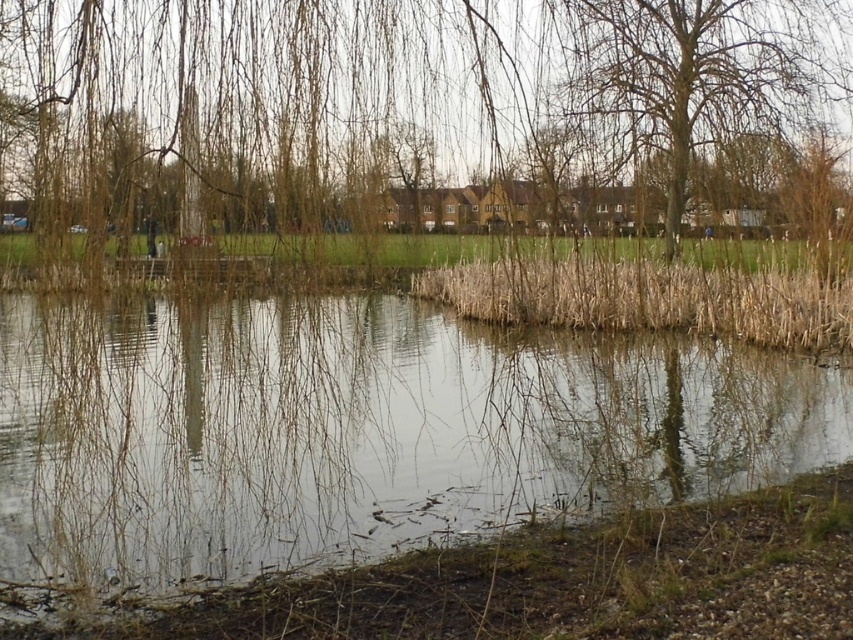
Question: Estimate the real-world distances between objects in this image. Which object is farther from the brown leafless branches at upper center?

Choices:
 (A) clear water at center
 (B) bare branches at upper center

Answer: (A)

Question: Considering the relative positions of clear water at center and bare branches at upper center in the image provided, where is clear water at center located with respect to bare branches at upper center?

Choices:
 (A) below
 (B) above

Answer: (A)

Question: Among these objects, which one is farthest from the camera?

Choices:
 (A) clear water at center
 (B) dry grass at center

Answer: (B)

Question: Is bare branches at upper center below dry grass at center?

Choices:
 (A) no
 (B) yes

Answer: (A)

Question: Does clear water at center appear on the left side of dry grass at center?

Choices:
 (A) yes
 (B) no

Answer: (A)

Question: Which point is farther to the camera?

Choices:
 (A) clear water at center
 (B) bare branches at upper center
 (C) brown leafless branches at upper center

Answer: (B)